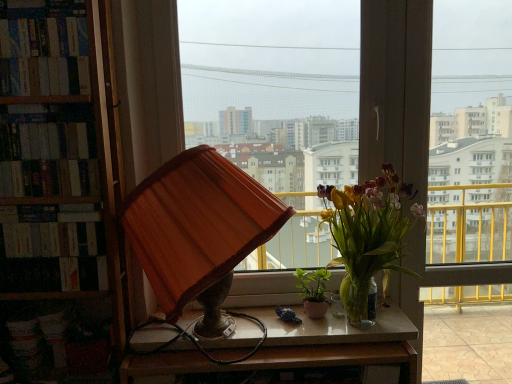
The height and width of the screenshot is (384, 512). What are the coordinates of `free space in front of green matte plant at center, marked as the 1th houseplant in a left-to-right arrangement` in the screenshot? It's located at (329, 329).